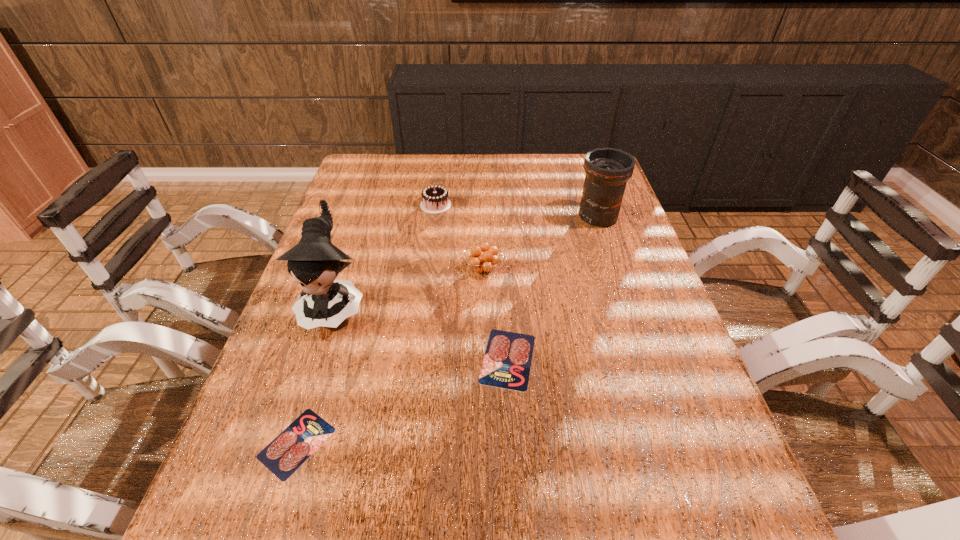
Find the location of `the left salami`. the left salami is located at coordinates (292, 447).

The image size is (960, 540). I want to click on the nearer salami, so click(x=292, y=447).

Where is `the taller salami`? The height and width of the screenshot is (540, 960). the taller salami is located at coordinates (507, 361).

Where is `the right salami`? The width and height of the screenshot is (960, 540). the right salami is located at coordinates (507, 361).

The height and width of the screenshot is (540, 960). I want to click on chocolate cake, so click(x=435, y=199).

The image size is (960, 540). In order to click on doll in this screenshot , I will do `click(314, 263)`.

The width and height of the screenshot is (960, 540). In order to click on orange fruit in this screenshot , I will do `click(483, 263)`.

Find the location of `telephoto lens`. telephoto lens is located at coordinates (607, 170).

You are a GUI agent. You are given a task and a screenshot of the screen. Output one action in this format:
    pyautogui.click(x=<x>, y=<y>)
    Task: Click on the rightmost object
    This screenshot has height=540, width=960.
    Given the screenshot: What is the action you would take?
    pyautogui.click(x=607, y=170)

Locate an element on the screen. The image size is (960, 540). free space located on the back of the nearest object is located at coordinates (323, 362).